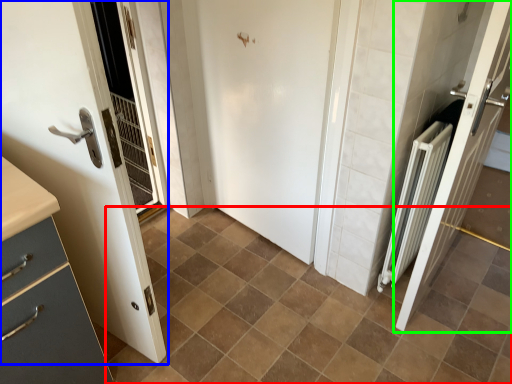
Question: Based on their relative distances, which object is nearer to ceramic tile (highlighted by a red box)? Choose from door (highlighted by a blue box) and door (highlighted by a green box).

Choices:
 (A) door
 (B) door

Answer: (B)